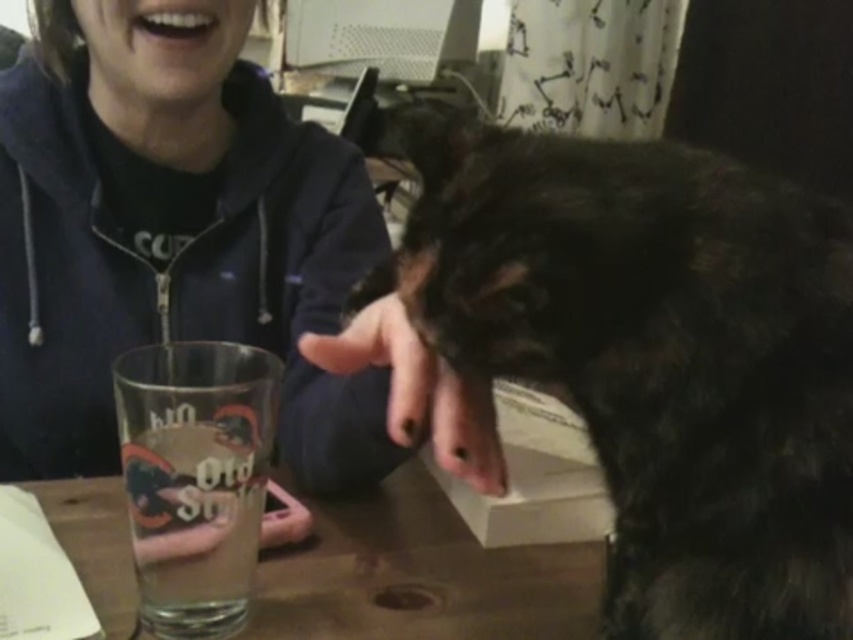
You are a photographer trying to capture the interaction between the dark fur dog at center and the white glossy teeth at upper center. Which object is located below the other in the image?

The dark fur dog at center is positioned under the white glossy teeth at upper center, so the dog is below the teeth.